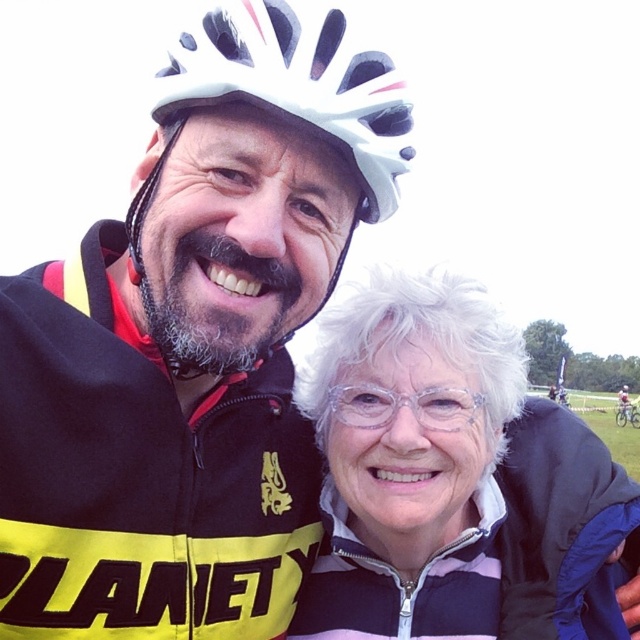
Based on the scene description, where is the white textured hair at center located in terms of coordinates?

The white textured hair at center is located at coordinates point (456, 481).

From the picture: You are a photographer taking a picture of the two people in the scene. You need to ensure that both the white matte bicycle helmet at upper center and the clear plastic glasses at center are visible in the frame. Based on their sizes, which object should you focus on to ensure both are in focus?

The white matte bicycle helmet at upper center is bigger than the clear plastic glasses at center, so focusing on the white matte bicycle helmet at upper center will help ensure both are in focus since it occupies more space in the frame.